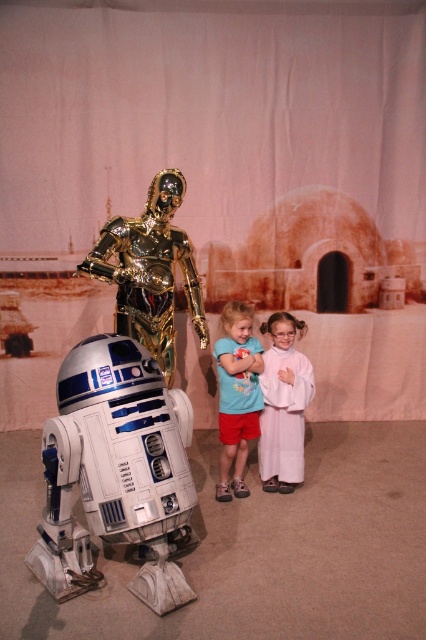
Which is below, silver metallic droid at lower left or blue cotton shirt at center?

silver metallic droid at lower left is below.

This screenshot has width=426, height=640. Describe the element at coordinates (115, 472) in the screenshot. I see `silver metallic droid at lower left` at that location.

Which is in front, point (43, 529) or point (242, 392)?

Point (43, 529)

At what (x,y) coordinates should I click in order to perform the action: click on silver metallic droid at lower left. Please return your answer as a coordinate pair (x, y). This screenshot has width=426, height=640. Looking at the image, I should click on (115, 472).

Does silver metallic droid at lower left have a greater height compared to white satin dress at center?

Indeed, silver metallic droid at lower left has a greater height compared to white satin dress at center.

Which is behind, point (81, 426) or point (287, 333)?

The point (287, 333) is more distant.

Find the location of a particular element. Image resolution: width=426 pixels, height=640 pixels. silver metallic droid at lower left is located at coordinates pos(115,472).

Is point (58, 486) farther from viewer compared to point (164, 205)?

No, it is not.

Can you confirm if silver metallic droid at lower left is shorter than gold metallic astronaut at center?

Yes.

Between point (164, 564) and point (129, 323), which one is positioned behind?

The point (129, 323) is more distant.

Where is `silver metallic droid at lower left`? Image resolution: width=426 pixels, height=640 pixels. silver metallic droid at lower left is located at coordinates (115, 472).